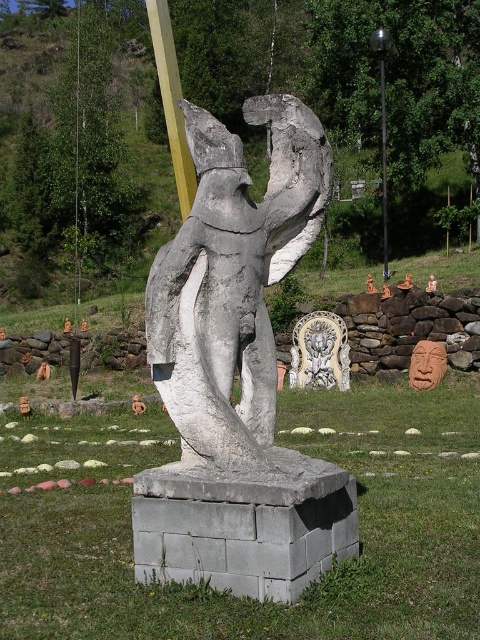
Question: Which point is closer to the camera?

Choices:
 (A) (256, 272)
 (B) (384, 244)

Answer: (A)

Question: Can you confirm if gray concrete statue at center is wider than metallic pole at upper center?

Choices:
 (A) no
 (B) yes

Answer: (A)

Question: Can you confirm if gray concrete statue at center is thinner than metallic pole at upper center?

Choices:
 (A) no
 (B) yes

Answer: (B)

Question: Which of the following is the closest to the observer?

Choices:
 (A) (330, 170)
 (B) (382, 124)

Answer: (A)

Question: Does gray concrete statue at center appear on the right side of metallic pole at upper center?

Choices:
 (A) yes
 (B) no

Answer: (B)